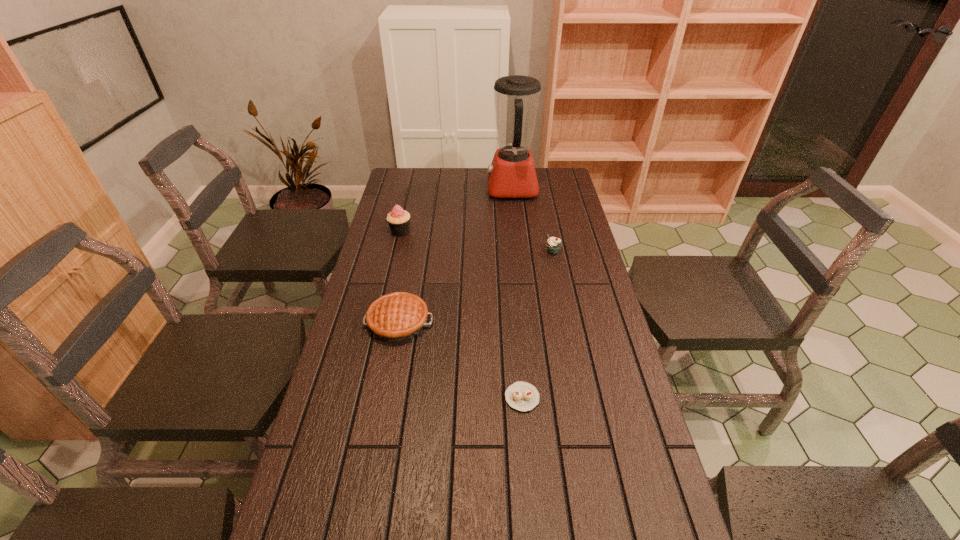
In order to click on cupcake that is positioned at the right edge in this screenshot , I will do `click(553, 244)`.

I want to click on object at the far right corner, so click(x=512, y=174).

Identify the location of blank area at the far edge. This screenshot has width=960, height=540. (473, 170).

In the image, there is a desktop. Where is `free space at the left edge`? This screenshot has width=960, height=540. free space at the left edge is located at coordinates click(x=400, y=202).

Where is `vacant region at the right edge of the desktop`? vacant region at the right edge of the desktop is located at coordinates (608, 335).

This screenshot has height=540, width=960. In order to click on blank space at the far left corner in this screenshot , I will do `click(411, 173)`.

The image size is (960, 540). Identify the location of vacant region between the leftmost cupcake and the pie. (399, 277).

Where is `free space between the farthest object and the second farthest cupcake`? free space between the farthest object and the second farthest cupcake is located at coordinates (533, 220).

Where is `vacant space in between the second nearest object and the rightmost cupcake`? vacant space in between the second nearest object and the rightmost cupcake is located at coordinates (x=476, y=287).

Where is `free space that is in between the rightmost cupcake and the fourth farthest object`? free space that is in between the rightmost cupcake and the fourth farthest object is located at coordinates (476, 287).